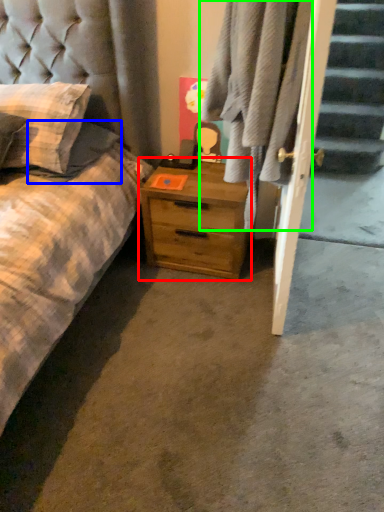
Question: Considering the real-world distances, which object is closest to nightstand (highlighted by a red box)? pillow (highlighted by a blue box) or plaid (highlighted by a green box).

Choices:
 (A) pillow
 (B) plaid

Answer: (B)